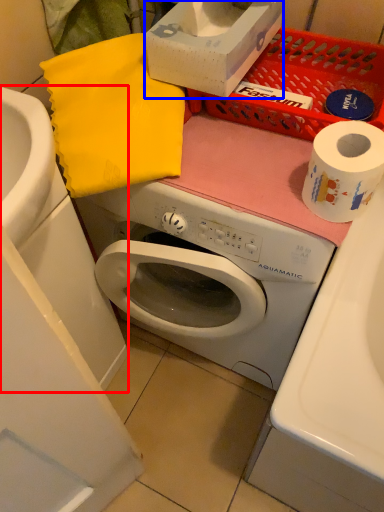
Question: Which object is further to the camera taking this photo, sink (highlighted by a red box) or box (highlighted by a blue box)?

Choices:
 (A) sink
 (B) box

Answer: (B)